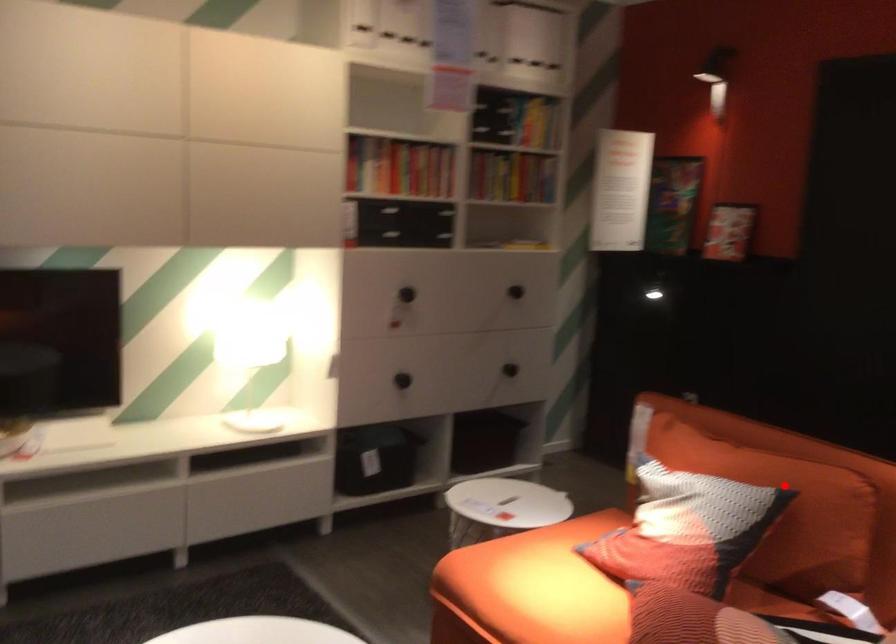
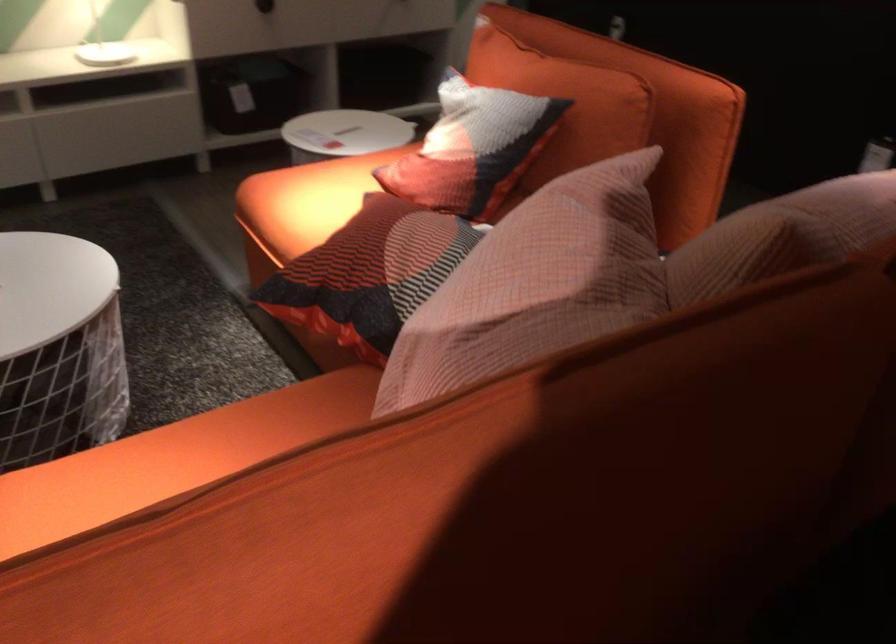
Where in the second image is the point corresponding to the highlighted location from the first image?

(564, 102)